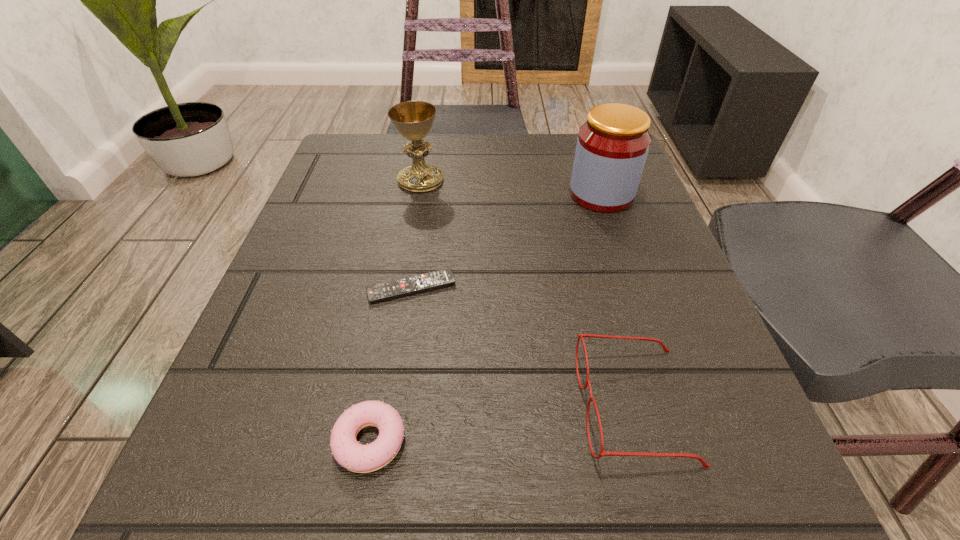
This screenshot has height=540, width=960. Identify the location of vacant space at the near left corner of the desktop. (188, 521).

This screenshot has width=960, height=540. Identify the location of vacant region between the third shortest object and the doughnut. (502, 423).

Image resolution: width=960 pixels, height=540 pixels. What are the coordinates of `vacant space in between the third shortest object and the jar` in the screenshot? It's located at (618, 300).

This screenshot has width=960, height=540. In order to click on vacant space that is in between the jar and the chalice in this screenshot , I will do `click(511, 187)`.

Where is `vacant area between the jar and the chalice`? vacant area between the jar and the chalice is located at coordinates (511, 187).

Locate an element on the screen. The width and height of the screenshot is (960, 540). unoccupied area between the shortest object and the doughnut is located at coordinates (391, 364).

Find the location of a particular element. The image size is (960, 540). vacant area that lies between the jar and the third nearest object is located at coordinates (507, 241).

Image resolution: width=960 pixels, height=540 pixels. I want to click on vacant area that lies between the chalice and the third tallest object, so click(x=527, y=293).

Identify the location of vacant area between the jar and the shortest object. (507, 241).

Image resolution: width=960 pixels, height=540 pixels. In order to click on unoccupied area between the jar and the chalice in this screenshot , I will do `click(511, 187)`.